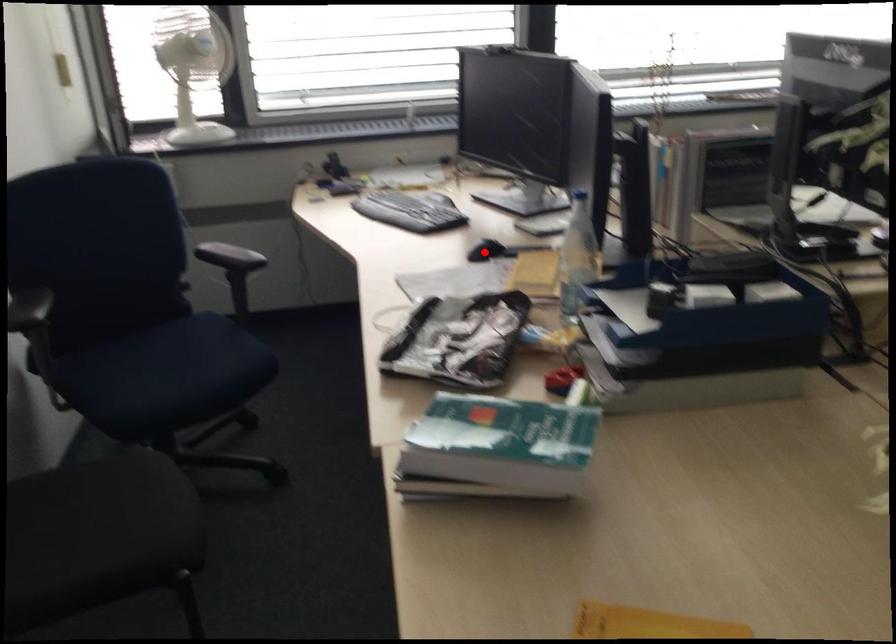
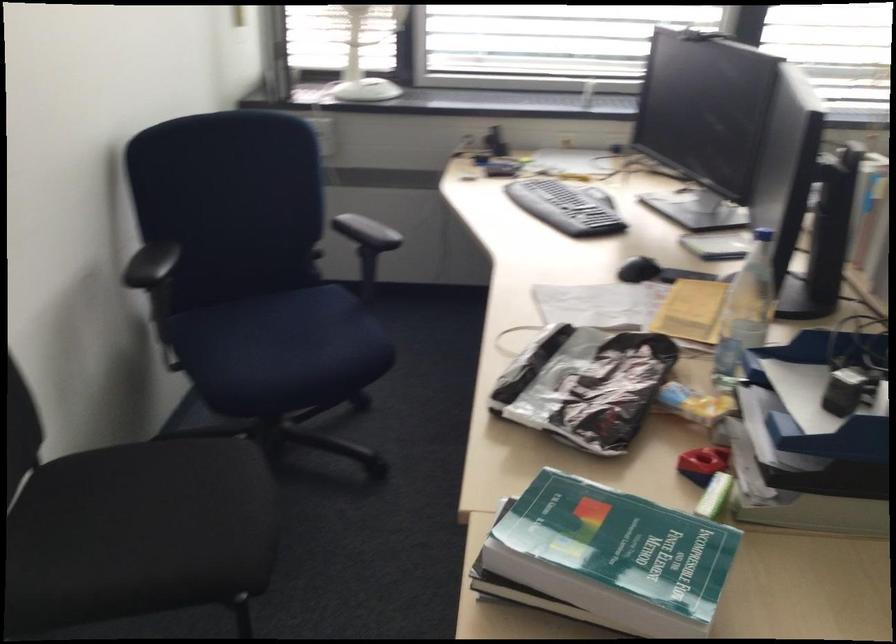
Where in the second image is the point corresponding to the highlighted location from the first image?

(639, 269)